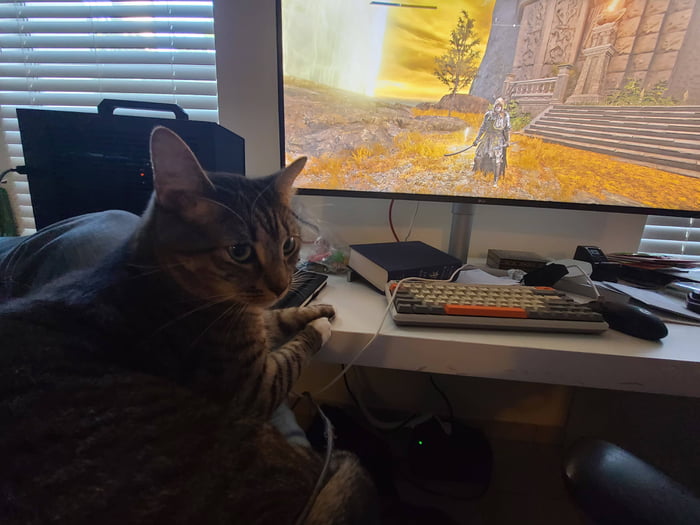
Locate an element on the screen. stack of mail is located at coordinates (656, 265).